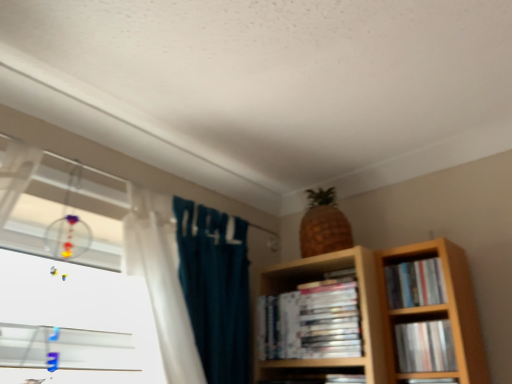
Question: From a real-world perspective, is matte plastic book at lower right, arranged as the 3th book when viewed from the left, under matte black book at lower right, which appears as the third book when viewed from the right?

Choices:
 (A) yes
 (B) no

Answer: (B)

Question: Is matte plastic book at lower right, arranged as the 3th book when viewed from the left, wider than matte black book at lower right, the 2th book from the left?

Choices:
 (A) no
 (B) yes

Answer: (A)

Question: Can you confirm if matte plastic book at lower right, arranged as the 3th book when viewed from the left, is positioned to the right of matte black book at lower right, which appears as the third book when viewed from the right?

Choices:
 (A) yes
 (B) no

Answer: (A)

Question: Can you confirm if matte plastic book at lower right, which is the second book in right-to-left order, is thinner than matte black book at lower right, which appears as the third book when viewed from the right?

Choices:
 (A) no
 (B) yes

Answer: (B)

Question: Does matte plastic book at lower right, which is the second book in right-to-left order, appear on the left side of matte black book at lower right, the 2th book from the left?

Choices:
 (A) yes
 (B) no

Answer: (B)

Question: Is matte plastic book at lower right, arranged as the 3th book when viewed from the left, oriented away from matte black book at lower right, which appears as the third book when viewed from the right?

Choices:
 (A) no
 (B) yes

Answer: (A)

Question: From a real-world perspective, is matte plastic books at center, the first book viewed from the left, on matte black book at lower right, which appears as the third book when viewed from the right?

Choices:
 (A) yes
 (B) no

Answer: (A)

Question: Is matte plastic books at center, the first book viewed from the left, further to the viewer compared to matte black book at lower right, the 2th book from the left?

Choices:
 (A) no
 (B) yes

Answer: (B)

Question: Is matte plastic books at center, which is the 4th book from right to left, not within matte black book at lower right, which appears as the third book when viewed from the right?

Choices:
 (A) yes
 (B) no

Answer: (A)

Question: Can you confirm if matte plastic books at center, the first book viewed from the left, is thinner than matte black book at lower right, the 2th book from the left?

Choices:
 (A) yes
 (B) no

Answer: (B)

Question: Can matte black book at lower right, the 2th book from the left, be found inside matte plastic books at center, the first book viewed from the left?

Choices:
 (A) yes
 (B) no

Answer: (B)

Question: Does matte plastic books at center, which is the 4th book from right to left, have a greater width compared to matte black book at lower right, the 2th book from the left?

Choices:
 (A) no
 (B) yes

Answer: (B)

Question: Can you confirm if matte plastic books at center, the first book viewed from the left, is positioned to the left of matte plastic book at lower right, arranged as the 3th book when viewed from the left?

Choices:
 (A) no
 (B) yes

Answer: (B)